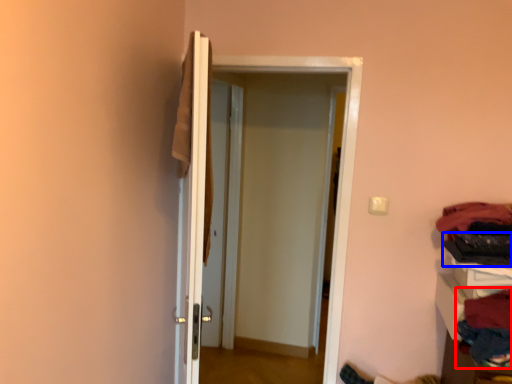
Question: Which object appears farthest to the camera in this image, clothing (highlighted by a red box) or clothing (highlighted by a blue box)?

Choices:
 (A) clothing
 (B) clothing

Answer: (B)